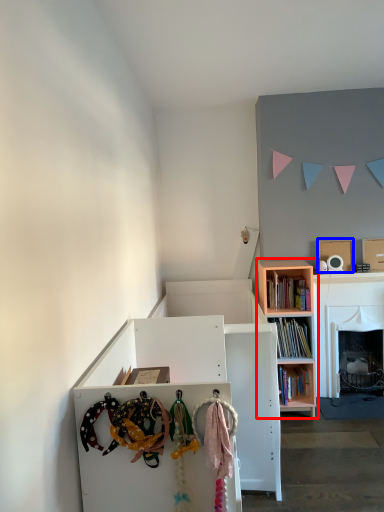
Question: Among these objects, which one is nearest to the camera, bookcase (highlighted by a red box) or cardboard box (highlighted by a blue box)?

Choices:
 (A) bookcase
 (B) cardboard box

Answer: (A)